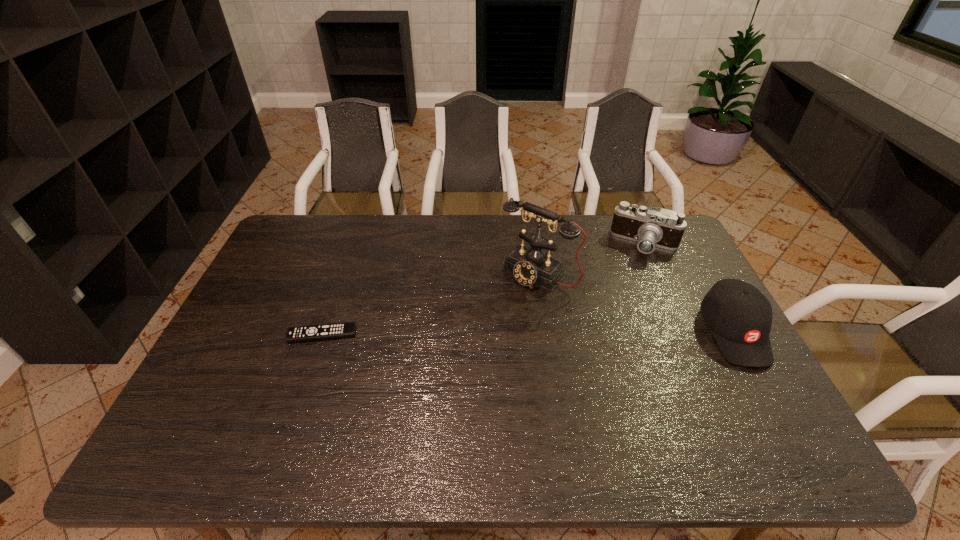
Image resolution: width=960 pixels, height=540 pixels. Identify the location of vacant space on the desktop that is between the leftmost object and the baseball cap and is positioned on the dial of the second object from left to right. (483, 334).

What are the coordinates of `vacant space on the desktop that is between the shortest object and the baseball cap and is positioned at the lens of the camera` in the screenshot? It's located at (589, 333).